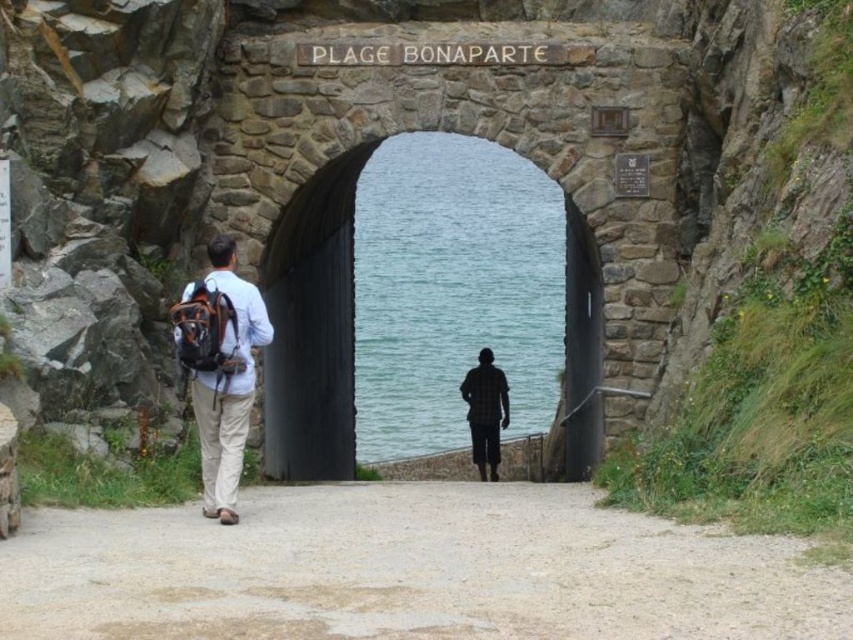
You are a hiker who just arrived at Plage Bonaparte beach through the stone archway. You have a matte black backpack at left and a plaid fabric shirt at center. Which item is wider?

The matte black backpack at left is wider than the plaid fabric shirt at center.

You are standing at the Plage Bonaparte archway and see the clear blue water at center and the plaid fabric shirt at center. Which object is higher in the image?

The clear blue water at center is located above the plaid fabric shirt at center, so it is higher in the image.